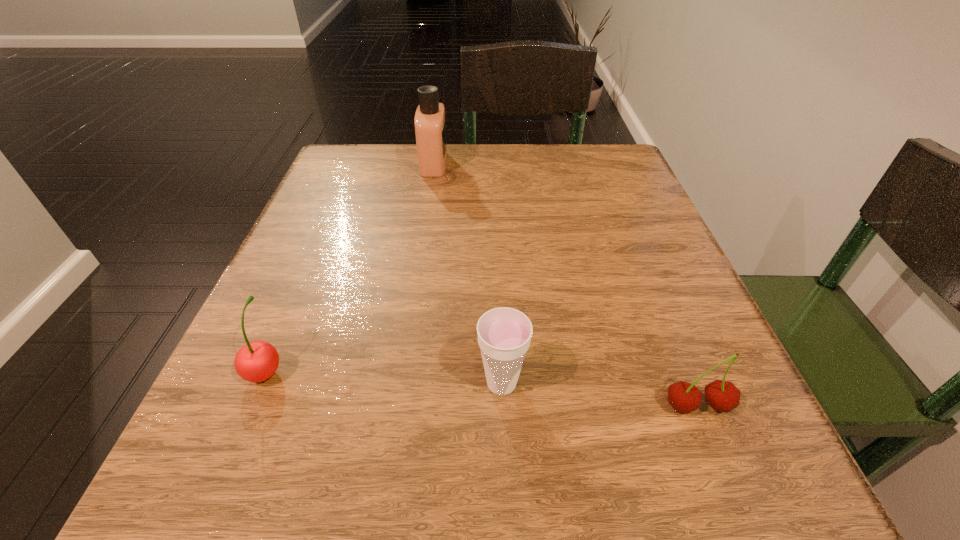
What are the coordinates of `object identified as the closest to the second object from right to left` in the screenshot? It's located at (724, 396).

Identify which object is located as the second nearest to the second object from right to left. Please provide its 2D coordinates. Your answer should be formatted as a tuple, i.e. [(x, y)], where the tuple contains the x and y coordinates of a point satisfying the conditions above.

[(257, 361)]

Identify the location of free point that satisfies the following two spatial constraints: 1. on the front label of the cup; 2. on the left side of the farthest object. (399, 384).